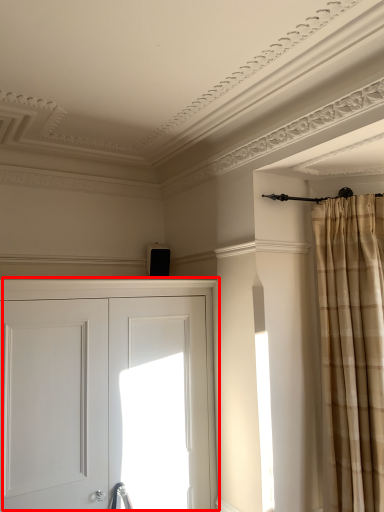
Question: Observing the image, what is the correct spatial positioning of door (annotated by the red box) in reference to curtain?

Choices:
 (A) left
 (B) right

Answer: (A)